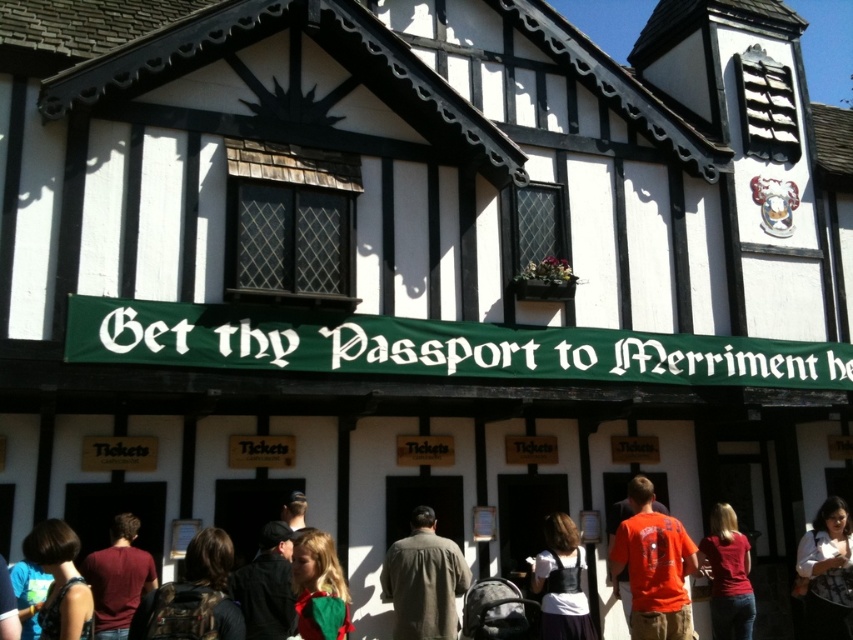
You are a photographer standing in front of the Tudor building. You see a matte maroon shirt at center and a white cotton dress at center. Which one is shorter?

The matte maroon shirt at center is shorter than the white cotton dress at center.

You are a visitor at the Tudor building and want to approach the ticket counter. You notice two people in the crowd near the entrance wearing a matte maroon shirt at center and a matte red shirt at lower right. Which person is shorter?

The matte maroon shirt at center is not as tall as the matte red shirt at lower right, so the person wearing the matte maroon shirt at center is shorter.